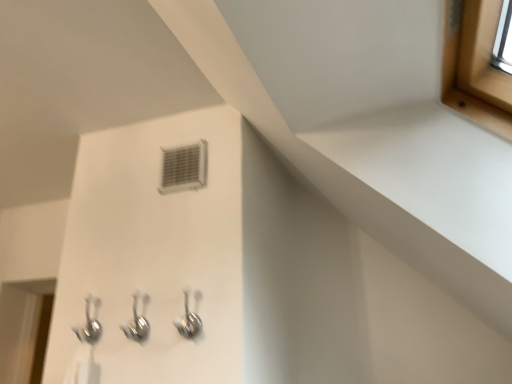
Question: Is white plastic air conditioning at center surrounding satin nickel hooks at center, which ranks as the third plumbing fixture in left-to-right order?

Choices:
 (A) no
 (B) yes

Answer: (A)

Question: Is white plastic air conditioning at center smaller than satin nickel hooks at center, positioned as the 1th plumbing fixture in right-to-left order?

Choices:
 (A) yes
 (B) no

Answer: (A)

Question: Does white plastic air conditioning at center come behind satin nickel hooks at center, which ranks as the third plumbing fixture in left-to-right order?

Choices:
 (A) yes
 (B) no

Answer: (A)

Question: Considering the relative sizes of white plastic air conditioning at center and satin nickel hooks at center, positioned as the 1th plumbing fixture in right-to-left order, in the image provided, is white plastic air conditioning at center bigger than satin nickel hooks at center, positioned as the 1th plumbing fixture in right-to-left order,?

Choices:
 (A) no
 (B) yes

Answer: (A)

Question: Is satin nickel hooks at center, which ranks as the third plumbing fixture in left-to-right order, at the back of white plastic air conditioning at center?

Choices:
 (A) yes
 (B) no

Answer: (B)

Question: From a real-world perspective, is white plastic air conditioning at center physically below satin nickel hooks at center, which ranks as the third plumbing fixture in left-to-right order?

Choices:
 (A) yes
 (B) no

Answer: (B)

Question: From the image's perspective, is polished chrome hooks at lower left, arranged as the third plumbing fixture when viewed from the right, on top of satin nickel hooks at center, positioned as the 1th plumbing fixture in right-to-left order?

Choices:
 (A) yes
 (B) no

Answer: (B)

Question: Would you say satin nickel hooks at center, positioned as the 1th plumbing fixture in right-to-left order, is part of polished chrome hooks at lower left, arranged as the third plumbing fixture when viewed from the right,'s contents?

Choices:
 (A) yes
 (B) no

Answer: (B)

Question: Can you confirm if polished chrome hooks at lower left, arranged as the third plumbing fixture when viewed from the right, is shorter than satin nickel hooks at center, positioned as the 1th plumbing fixture in right-to-left order?

Choices:
 (A) yes
 (B) no

Answer: (B)

Question: Is polished chrome hooks at lower left, arranged as the third plumbing fixture when viewed from the right, turned away from satin nickel hooks at center, positioned as the 1th plumbing fixture in right-to-left order?

Choices:
 (A) yes
 (B) no

Answer: (B)

Question: Is polished chrome hooks at lower left, arranged as the third plumbing fixture when viewed from the right, smaller than satin nickel hooks at center, positioned as the 1th plumbing fixture in right-to-left order?

Choices:
 (A) yes
 (B) no

Answer: (A)

Question: Can you confirm if polished chrome hooks at lower left, arranged as the third plumbing fixture when viewed from the right, is bigger than satin nickel hooks at center, positioned as the 1th plumbing fixture in right-to-left order?

Choices:
 (A) no
 (B) yes

Answer: (A)

Question: Are satin nickel hooks at center, which ranks as the third plumbing fixture in left-to-right order, and polished chrome hooks at lower center, the 2th plumbing fixture viewed from the left, far apart?

Choices:
 (A) no
 (B) yes

Answer: (A)